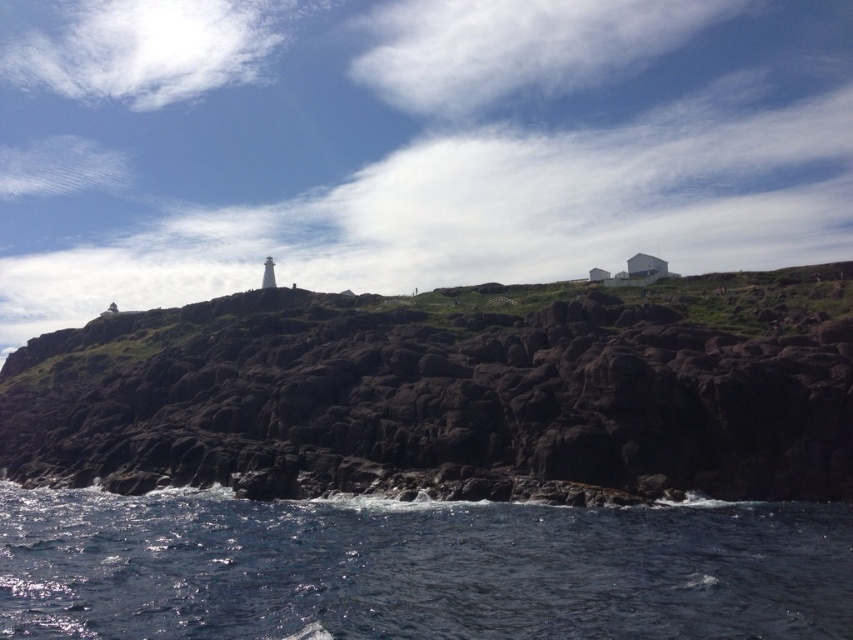
Question: Is dark brown rocky cliff at center positioned at the back of dark blue water at lower left?

Choices:
 (A) no
 (B) yes

Answer: (B)

Question: Can you confirm if dark brown rocky cliff at center is bigger than dark blue water at lower left?

Choices:
 (A) no
 (B) yes

Answer: (B)

Question: Which object is farther from the camera taking this photo?

Choices:
 (A) dark blue water at lower left
 (B) dark brown rocky cliff at center

Answer: (B)

Question: Where is dark brown rocky cliff at center located in relation to dark blue water at lower left in the image?

Choices:
 (A) right
 (B) left

Answer: (B)

Question: Which point is farther from the camera taking this photo?

Choices:
 (A) (47, 428)
 (B) (157, 576)

Answer: (A)